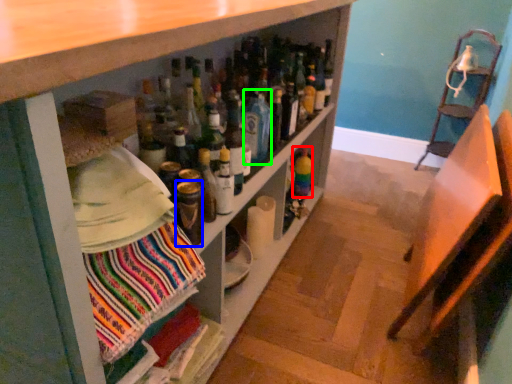
Question: Considering the real-world distances, which object is farthest from bottle (highlighted by a red box)? bottle (highlighted by a blue box) or beverage (highlighted by a green box)?

Choices:
 (A) bottle
 (B) beverage

Answer: (A)